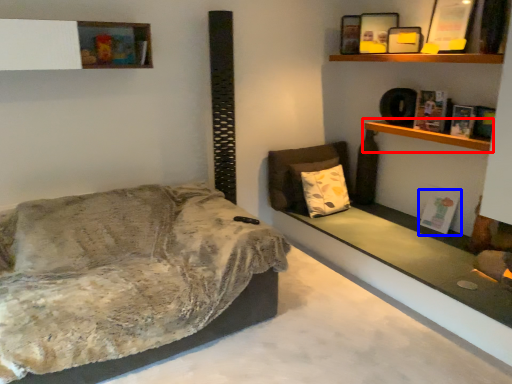
Question: Which of the following is the closest to the observer, shelf (highlighted by a red box) or book (highlighted by a blue box)?

Choices:
 (A) shelf
 (B) book

Answer: (A)